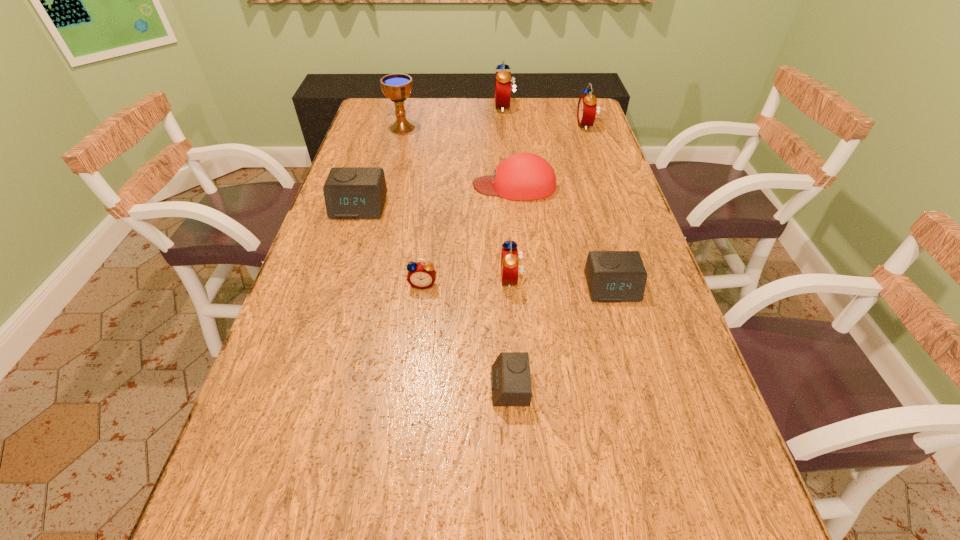
The image size is (960, 540). Find the location of `vacant position in the image that satisfies the following two spatial constraints: 1. on the front-facing side of the second biggest black alarm clock; 2. on the front-facing side of the second black alarm clock from right to left`. vacant position in the image that satisfies the following two spatial constraints: 1. on the front-facing side of the second biggest black alarm clock; 2. on the front-facing side of the second black alarm clock from right to left is located at coordinates (640, 387).